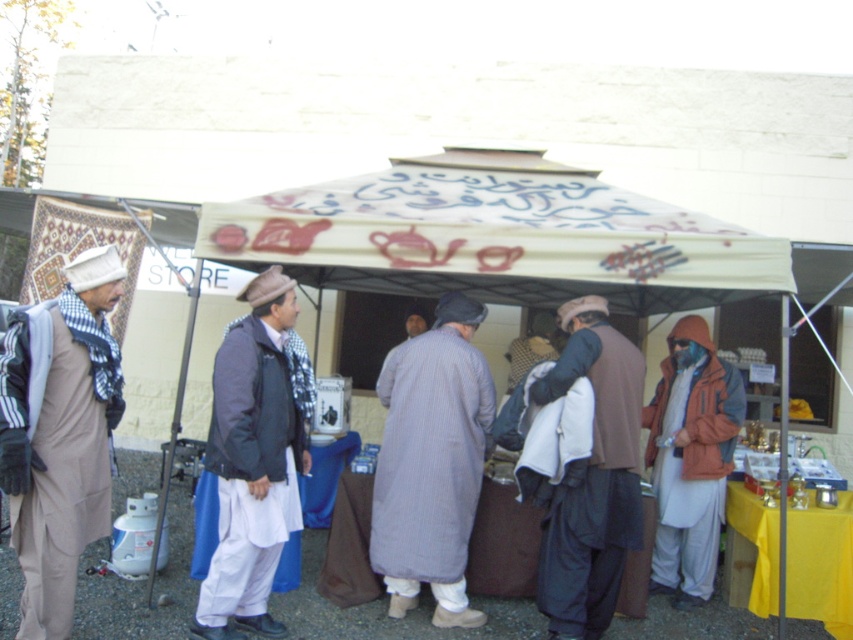
You are standing at the entrance of the outdoor market under the canopy tent. You see two points marked in the scene. Which point is closer to you, point (106, 365) or point (466, 406)?

Point (106, 365) is closer to you than point (466, 406).

You are a visitor at the market and want to take a photo of both the striped cotton robe at center and the blue fabric mask at right. Since you can only focus on one object at a time, which one should you focus on first to ensure the other is also in focus?

You should focus on the striped cotton robe at center first because it is closer to you than the blue fabric mask at right, and focusing on the closer object will keep the farther one in focus as well.